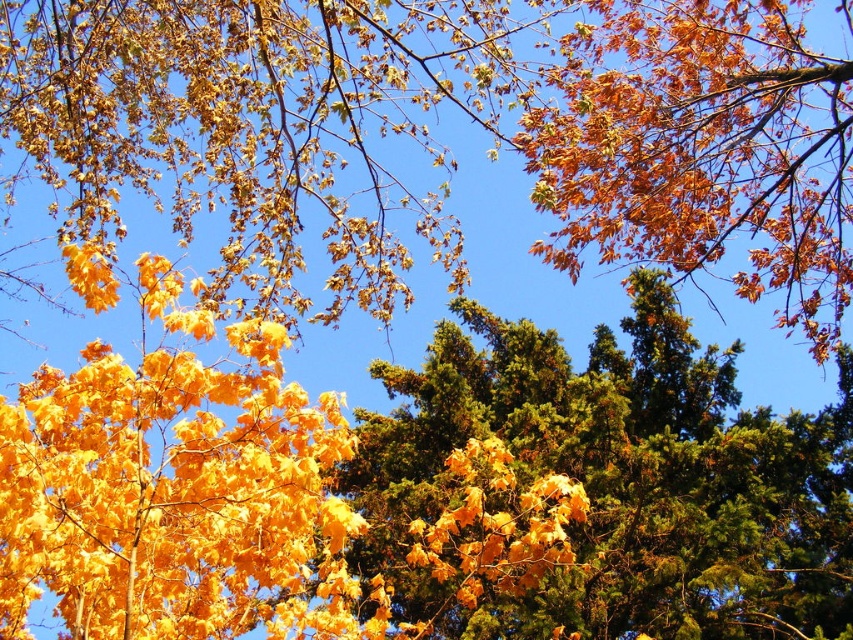
Looking at this image, you are an artist trying to paint this autumn scene. You want to ensure the green textured pine tree at center and the shiny golden leaves at left are proportionally accurate. Which object should you paint first if you want to start with the larger one?

The green textured pine tree at center is larger in size than the shiny golden leaves at left, so you should paint the green textured pine tree at center first.

You are standing in the autumn scene described. You notice a point marked at coordinates (x=601, y=486). What object is located at that point?

The point at coordinates (x=601, y=486) indicates a green textured pine tree at center.

You are a bird looking for a place to perch. You see the green textured pine tree at center and the shiny golden leaves at left. Which one is taller?

The green textured pine tree at center is taller than the shiny golden leaves at left, so the bird should choose the green textured pine tree at center for perching.